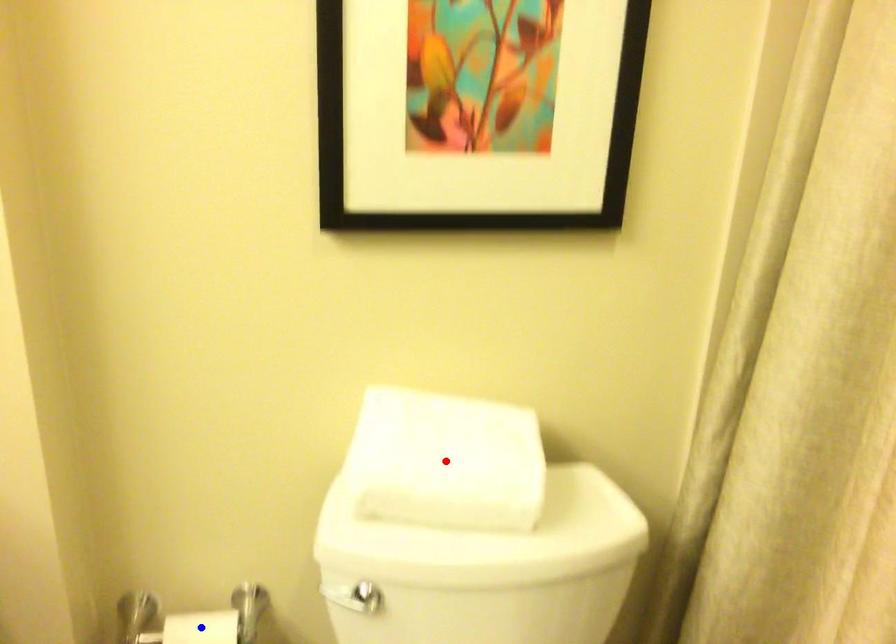
Question: Which of the two points in the image is closer to the camera?

Choices:
 (A) Blue point is closer.
 (B) Red point is closer.

Answer: (B)